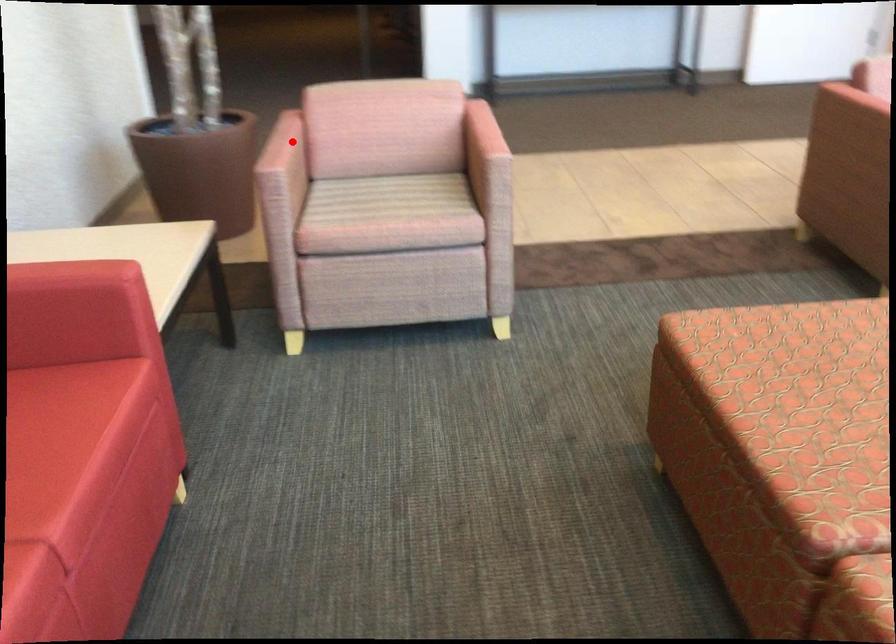
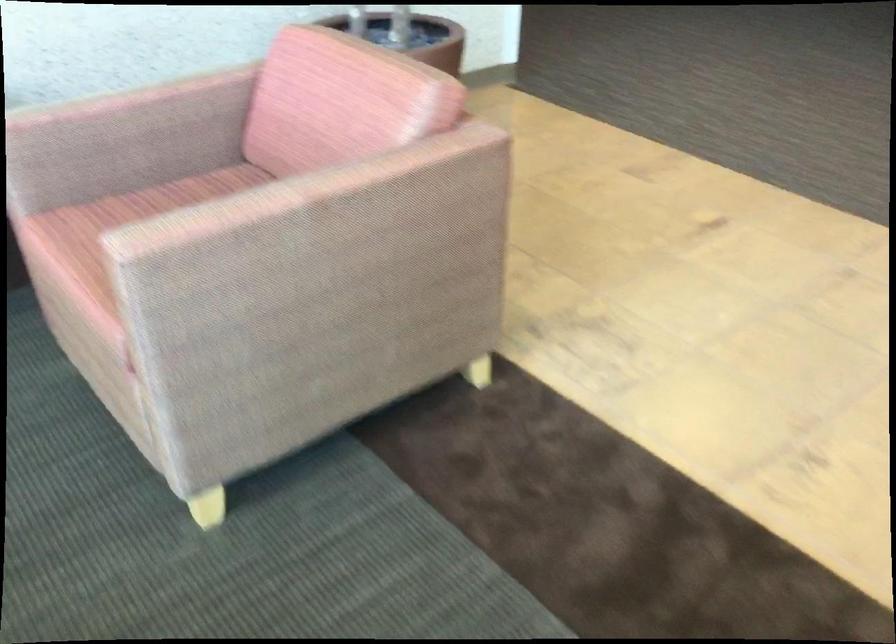
Question: A red point is marked in image1. In image2, is the corresponding 3D point closer to the camera or farther? Reply with the corresponding letter.

Choices:
 (A) The corresponding 3D point is closer.
 (B) The corresponding 3D point is farther.

Answer: (A)